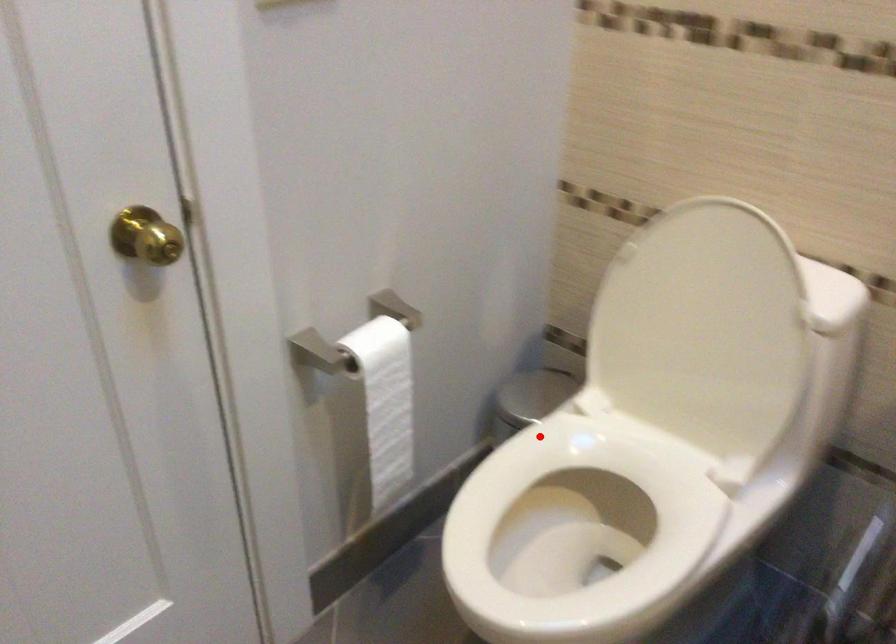
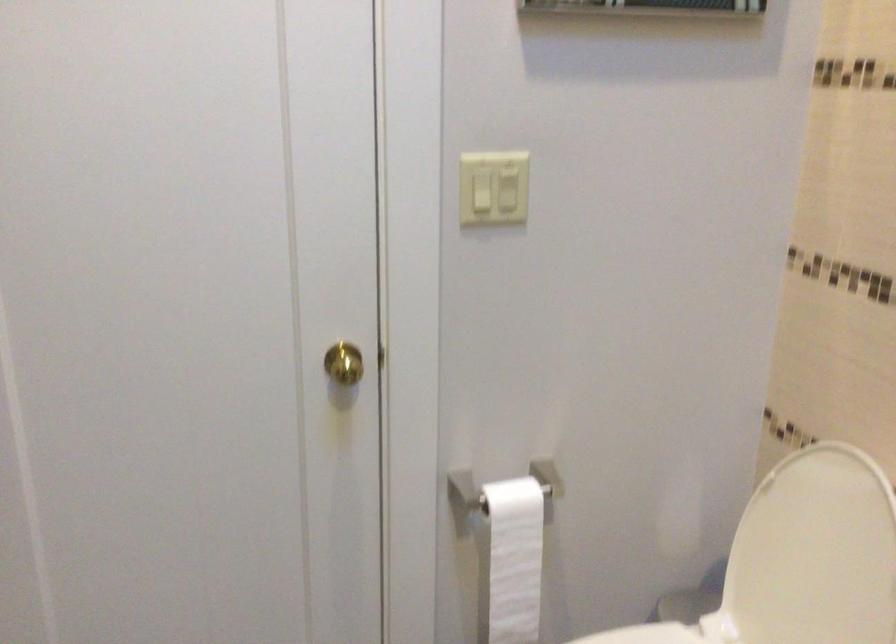
Find the pixel in the second image that matches the highlighted location in the first image.

(645, 635)